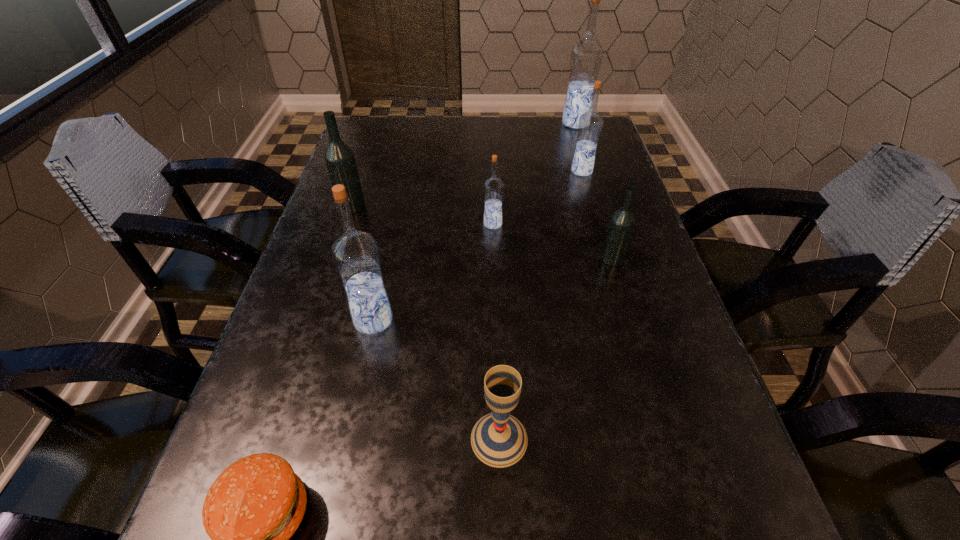
You are a GUI agent. You are given a task and a screenshot of the screen. Output one action in this format:
    pyautogui.click(x=<x>, y=<y>)
    Task: Click on the vacant area that lies between the gray chalice and the smallest blue vodka
    
    Given the screenshot: What is the action you would take?
    pyautogui.click(x=496, y=332)

Find the location of `free point between the second farthest vodka and the fifth shortest vodka`. free point between the second farthest vodka and the fifth shortest vodka is located at coordinates (477, 246).

In order to click on free spot between the second nearest vodka and the third blue vodka from right to left in this screenshot , I will do `click(552, 241)`.

Find the location of a particular element. The width and height of the screenshot is (960, 540). vacant space that is in between the gray chalice and the bigger black vodka is located at coordinates (425, 322).

This screenshot has height=540, width=960. Find the location of `free spot between the leftmost vodka and the third nearest blue vodka`. free spot between the leftmost vodka and the third nearest blue vodka is located at coordinates point(467,188).

Select which object appears as the sixth closest to the bigger black vodka. Please provide its 2D coordinates. Your answer should be formatted as a tuple, i.e. [(x, y)], where the tuple contains the x and y coordinates of a point satisfying the conditions above.

[(253, 508)]

Find the location of a particular element. This screenshot has height=540, width=960. object that is the sixth closest to the second nearest vodka is located at coordinates (340, 160).

Find the location of a particular element. The height and width of the screenshot is (540, 960). the fourth closest vodka to the nearest blue vodka is located at coordinates (590, 123).

Locate an element on the screen. The image size is (960, 540). vodka that can be found as the fourth closest to the biggest blue vodka is located at coordinates (340, 160).

Identify the location of blue vodka that is the third closest one to the shortest object. Image resolution: width=960 pixels, height=540 pixels. (590, 123).